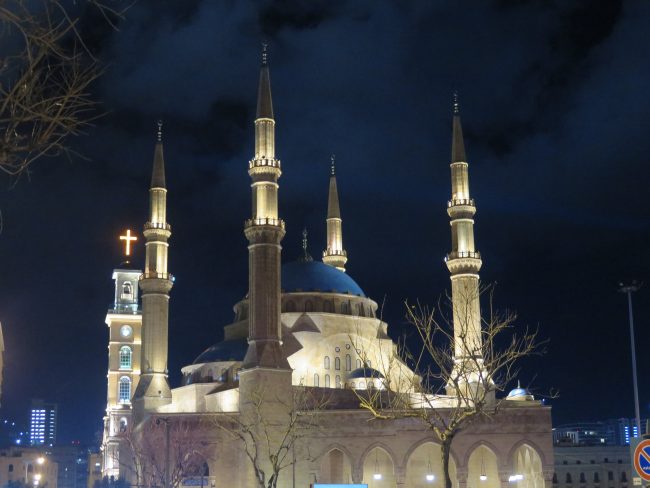
Find the location of `entrance way`. entrance way is located at coordinates pyautogui.click(x=421, y=459).